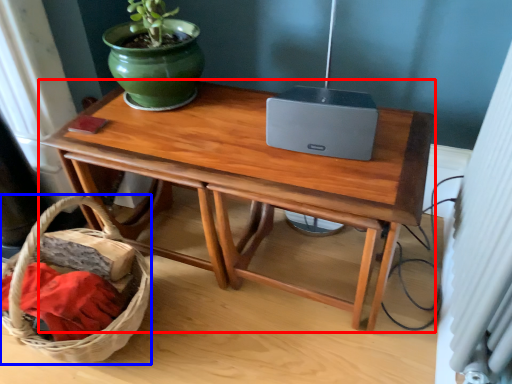
Question: Among these objects, which one is nearest to the camera, table (highlighted by a red box) or basket (highlighted by a blue box)?

Choices:
 (A) table
 (B) basket

Answer: (B)